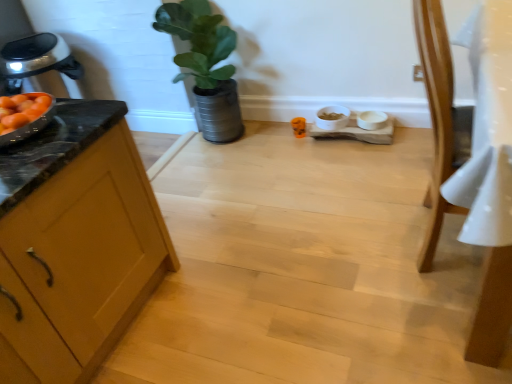
I want to click on vacant area that is in front of green matte plant at upper center, so click(x=239, y=163).